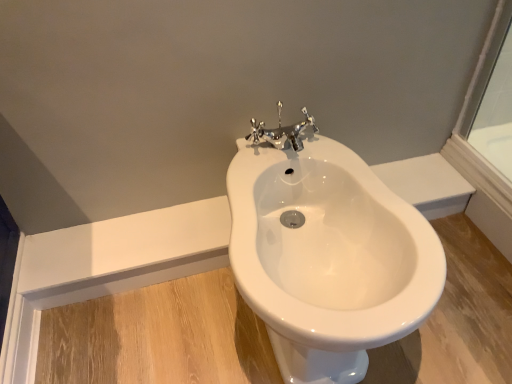
Find the location of a particular element. The width and height of the screenshot is (512, 384). free location to the left of white glossy bidet at center is located at coordinates (154, 337).